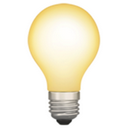
The image size is (128, 128). Find the location of `light`. light is located at coordinates (64, 59).